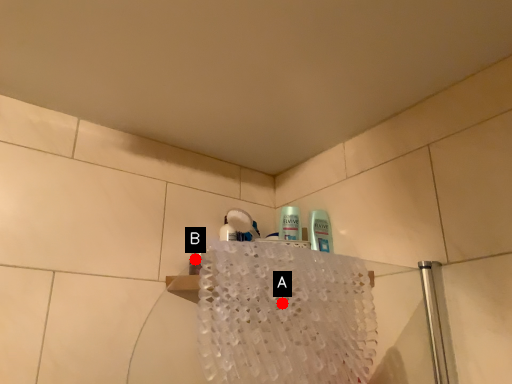
Question: Two points are circled on the image, labeled by A and B beside each circle. Which point is farther to the camera?

Choices:
 (A) A is further
 (B) B is further

Answer: (A)